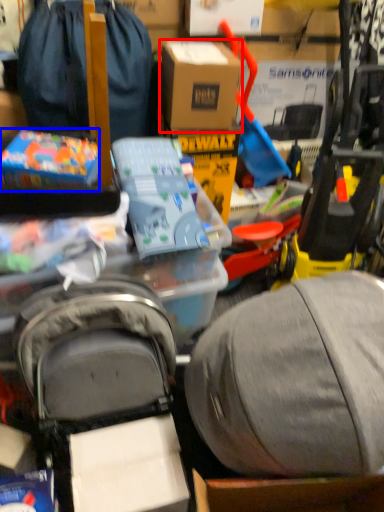
Question: Which point is further to the camera, box (highlighted by a red box) or toy (highlighted by a blue box)?

Choices:
 (A) box
 (B) toy

Answer: (A)